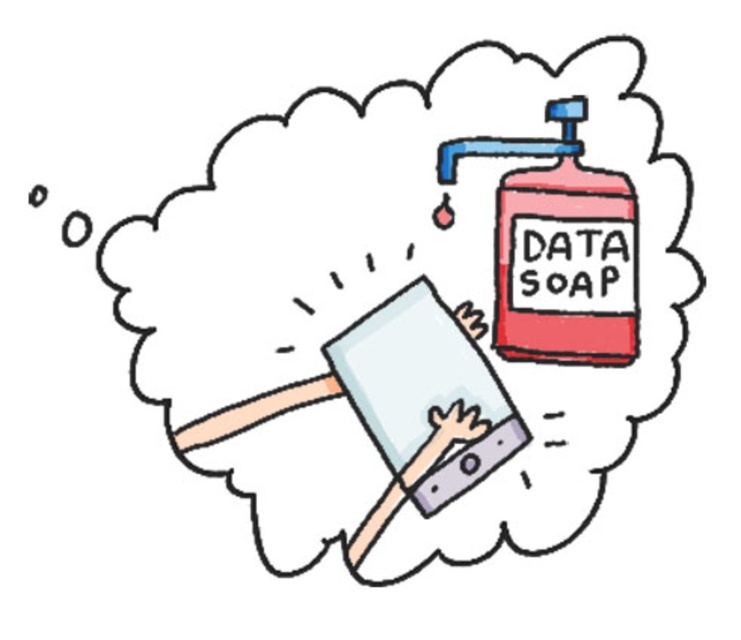
You are holding the matte gray hand at center and trying to grasp the matte red plastic data soap at upper right. Based on their sizes, will your hand be able to fully wrap around the soap?

The matte red plastic data soap at upper right is wider than the matte gray hand at center, so the hand cannot fully wrap around it.

You are an artist who wants to draw the scene shown. You have two hands in the image, a smooth skin hand at center and a matte gray hand at center. Which hand is on the left side?

The smooth skin hand at center is positioned on the left side of the matte gray hand at center.